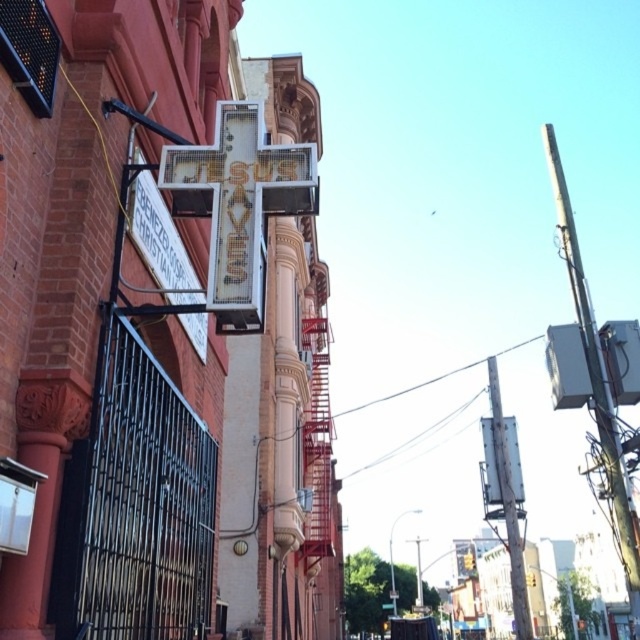
You are a photographer trying to capture the entire scene of the red brick building with both the metallic gray pole at upper right and the metallic gray sign at upper right in the frame. Given their sizes, which object would you need to position closer to the camera to ensure both fit in the shot?

The metallic gray pole at upper right is larger than the metallic gray sign at upper right. To fit both in the frame, position the metallic gray pole at upper right closer to the camera so its larger size doesn

You are a delivery person trying to park your 1.2 meter wide delivery cart between the metallic gray pole at upper right and the metallic gray sign at upper right. Can you fit your cart there?

The metallic gray pole at upper right is wider than the metallic gray sign at upper right. Therefore, the space between them might be too narrow for your 1.2 meter wide cart. You should look for another parking spot.